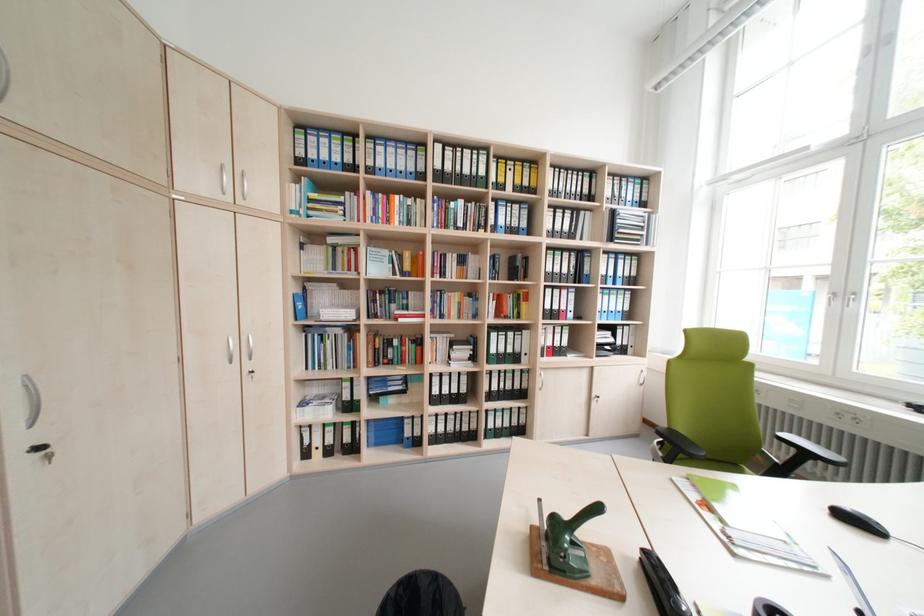
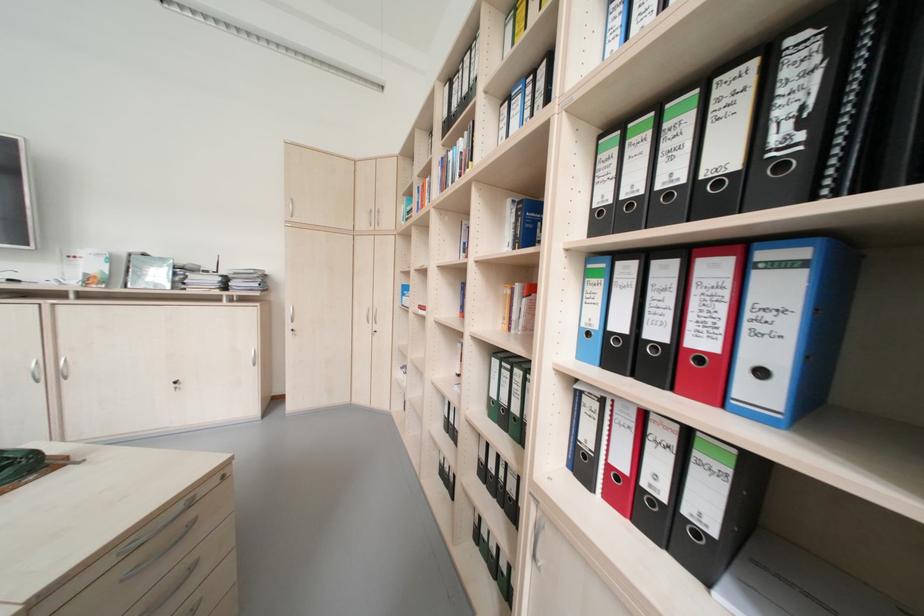
Where in the second image is the point corresponding to (581,297) from the first image?

(793, 290)